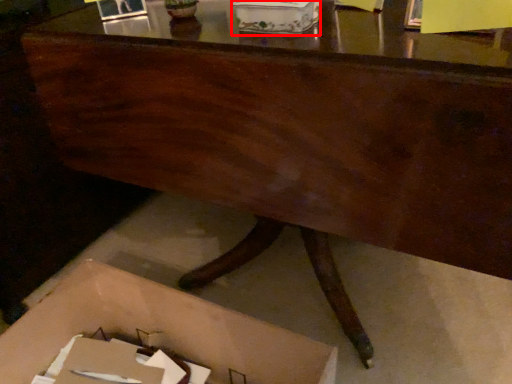
Question: Observing the image, what is the correct spatial positioning of storage box (annotated by the red box) in reference to storage box?

Choices:
 (A) left
 (B) right

Answer: (B)